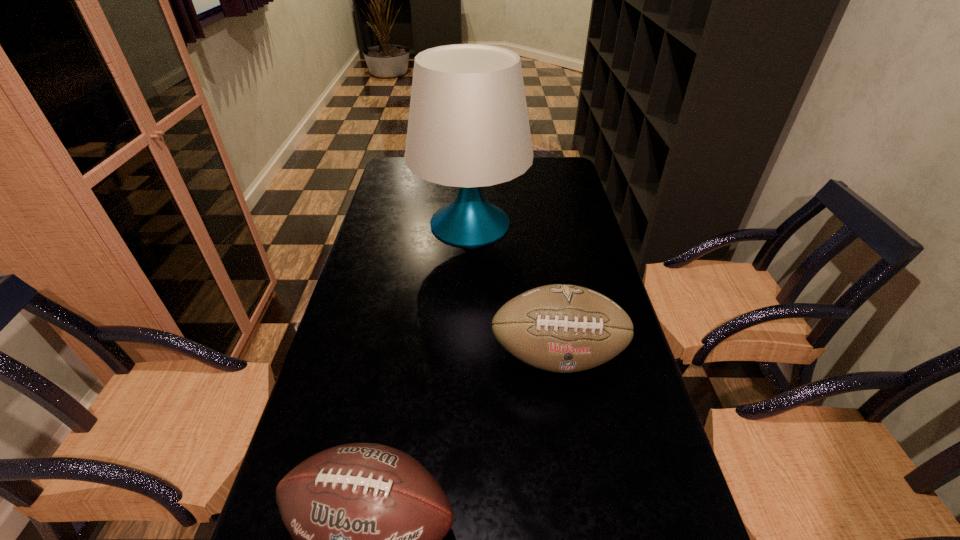
Where is `vacant region at the far right corner of the desktop`? This screenshot has width=960, height=540. vacant region at the far right corner of the desktop is located at coordinates (563, 176).

At what (x,y) coordinates should I click in order to perform the action: click on free space between the right football (American) and the farthest object. Please return your answer as a coordinate pair (x, y). Looking at the image, I should click on (514, 289).

You are a GUI agent. You are given a task and a screenshot of the screen. Output one action in this format:
    pyautogui.click(x=<x>, y=<y>)
    Task: Click on the vacant area between the right football (American) and the farthest object
    
    Given the screenshot: What is the action you would take?
    pyautogui.click(x=514, y=289)

At what (x,y) coordinates should I click in order to perform the action: click on empty location between the right football (American) and the tallest object. Please return your answer as a coordinate pair (x, y). This screenshot has width=960, height=540. Looking at the image, I should click on (514, 289).

Locate an element on the screen. The image size is (960, 540). object that is the nearest to the left football (American) is located at coordinates (559, 328).

This screenshot has width=960, height=540. Identify the location of object that is the second closest to the farthest object. (367, 520).